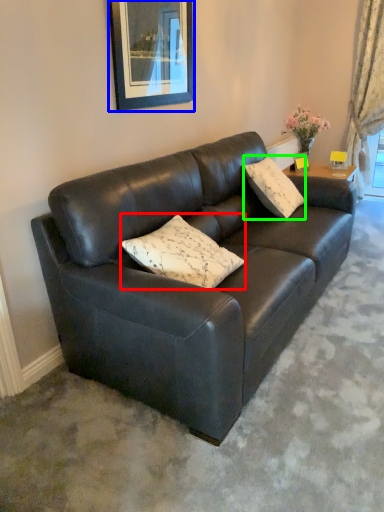
Question: Which is farther away from pillow (highlighted by a red box)? picture frame (highlighted by a blue box) or pillow (highlighted by a green box)?

Choices:
 (A) picture frame
 (B) pillow

Answer: (B)